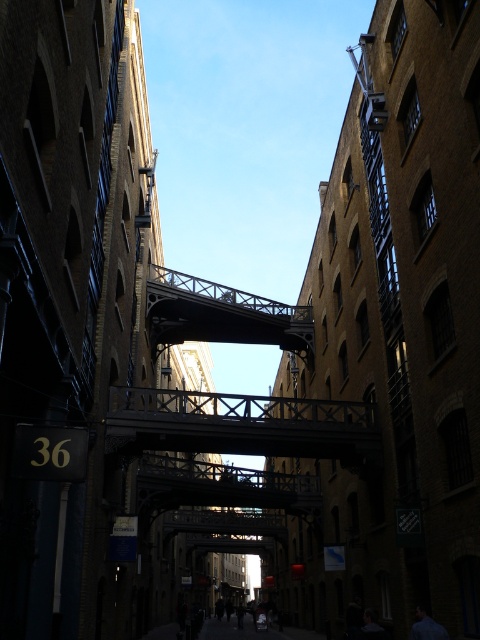
Question: Can you confirm if wooden bridge at center is wider than dark gray metal pedestrian bridge at center?

Choices:
 (A) yes
 (B) no

Answer: (A)

Question: Among these objects, which one is farthest from the camera?

Choices:
 (A) dark gray metal pedestrian bridge at center
 (B) wooden bridge at center

Answer: (A)

Question: Is wooden bridge at center bigger than dark gray metal pedestrian bridge at center?

Choices:
 (A) yes
 (B) no

Answer: (A)

Question: Can you confirm if wooden bridge at center is thinner than dark gray metal pedestrian bridge at center?

Choices:
 (A) no
 (B) yes

Answer: (A)

Question: Which object is farther from the camera taking this photo?

Choices:
 (A) dark gray metal pedestrian bridge at center
 (B) wooden bridge at center

Answer: (A)

Question: Which of the following is the closest to the observer?

Choices:
 (A) wooden bridge at center
 (B) dark gray metal pedestrian bridge at center

Answer: (A)